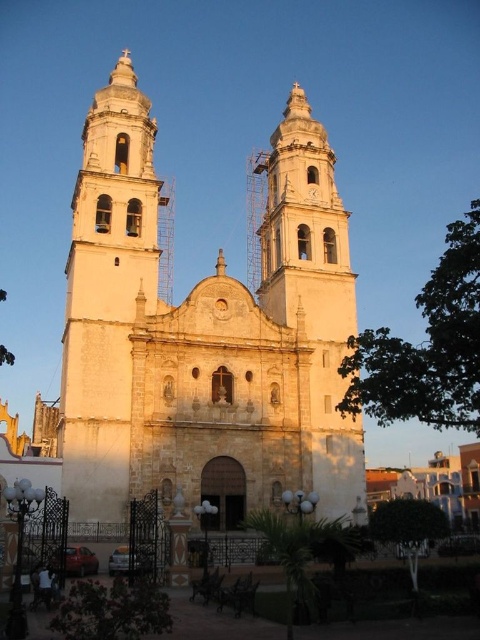
Who is positioned more to the right, white stone church at center or white stone tower at left?

white stone church at center

Describe the element at coordinates (204, 336) in the screenshot. I see `white stone church at center` at that location.

Identify the location of white stone church at center. (204, 336).